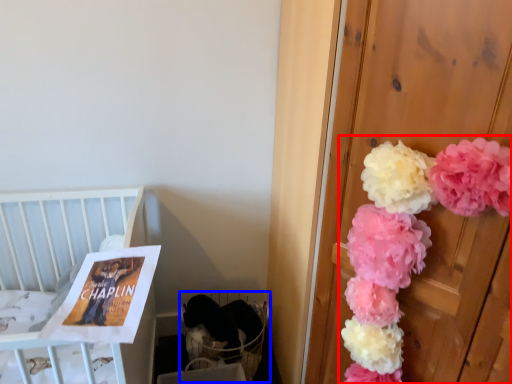
Question: Which object is closer to the camera taking this photo, floral arrangement (highlighted by a red box) or baby carriage (highlighted by a blue box)?

Choices:
 (A) floral arrangement
 (B) baby carriage

Answer: (A)